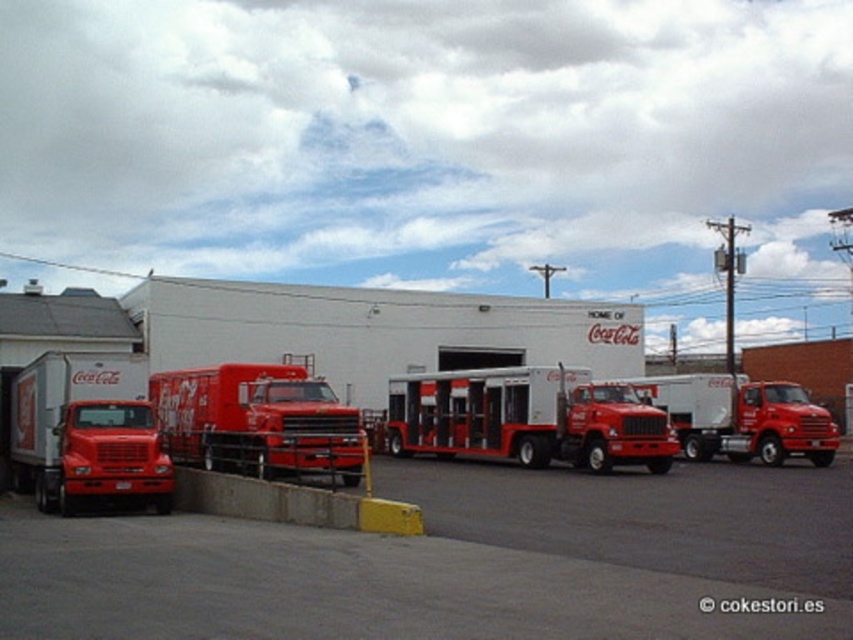
Question: Among these points, which one is nearest to the camera?

Choices:
 (A) (328, 522)
 (B) (820, 433)

Answer: (A)

Question: Is white glossy trailer at center positioned before matte red truck at center?

Choices:
 (A) yes
 (B) no

Answer: (A)

Question: Is matte red truck at left wider than matte red truck at center?

Choices:
 (A) yes
 (B) no

Answer: (A)

Question: Among these objects, which one is farthest from the camera?

Choices:
 (A) white glossy trailer at center
 (B) matte red truck at left
 (C) matte red truck at center
 (D) shiny red fire truck at center

Answer: (C)

Question: Does white glossy trailer at center lie in front of concrete barrier at lower center?

Choices:
 (A) yes
 (B) no

Answer: (B)

Question: Which point appears closest to the camera in this image?

Choices:
 (A) (688, 602)
 (B) (387, 518)
 (C) (480, 429)
 (D) (219, 428)

Answer: (A)